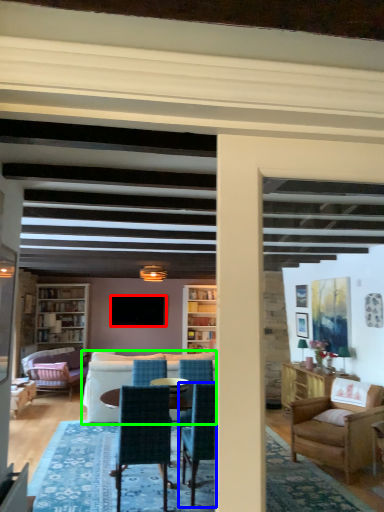
Question: Which object is positioned farthest from television (highlighted by a red box)? Select from chair (highlighted by a blue box) and studio couch (highlighted by a green box).

Choices:
 (A) chair
 (B) studio couch

Answer: (A)